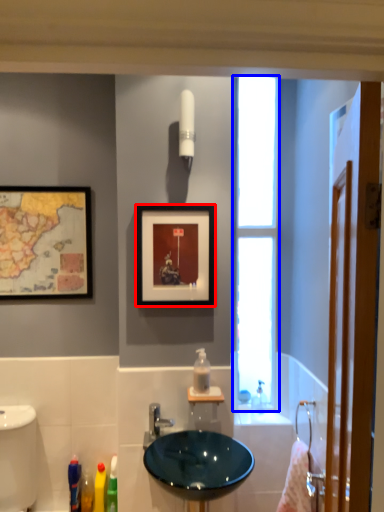
Question: Which of the following is the farthest to the observer, picture frame (highlighted by a red box) or window (highlighted by a blue box)?

Choices:
 (A) picture frame
 (B) window

Answer: (B)